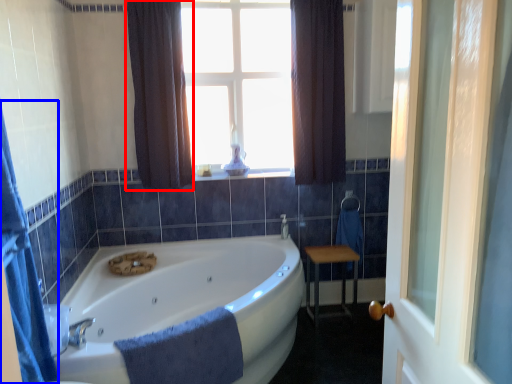
Question: Which of the following is the closest to the observer, curtain (highlighted by a red box) or shower curtain (highlighted by a blue box)?

Choices:
 (A) curtain
 (B) shower curtain

Answer: (B)